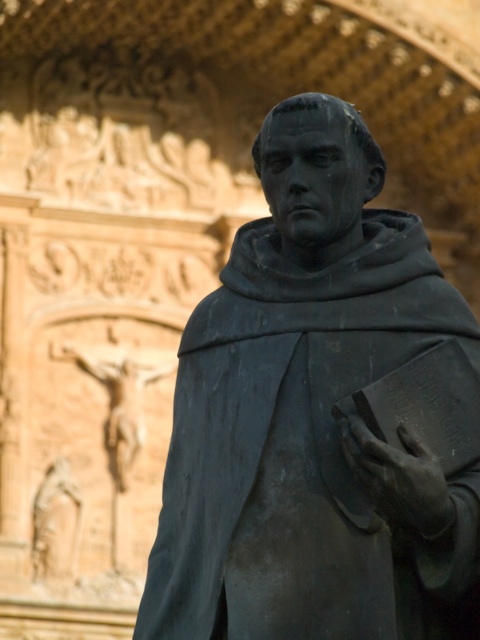
Is bronze statue at center thinner than matte black hand at lower right?

No, bronze statue at center is not thinner than matte black hand at lower right.

Does bronze statue at center appear on the right side of matte black hand at lower right?

Incorrect, bronze statue at center is not on the right side of matte black hand at lower right.

I want to click on bronze statue at center, so click(309, 413).

At what (x,y) coordinates should I click in order to perform the action: click on bronze statue at center. Please return your answer as a coordinate pair (x, y). Looking at the image, I should click on (309, 413).